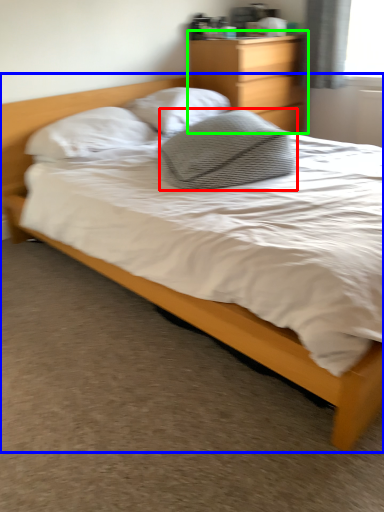
Question: Which is nearer to the pillow (highlighted by a red box)? bed (highlighted by a blue box) or nightstand (highlighted by a green box).

Choices:
 (A) bed
 (B) nightstand

Answer: (A)